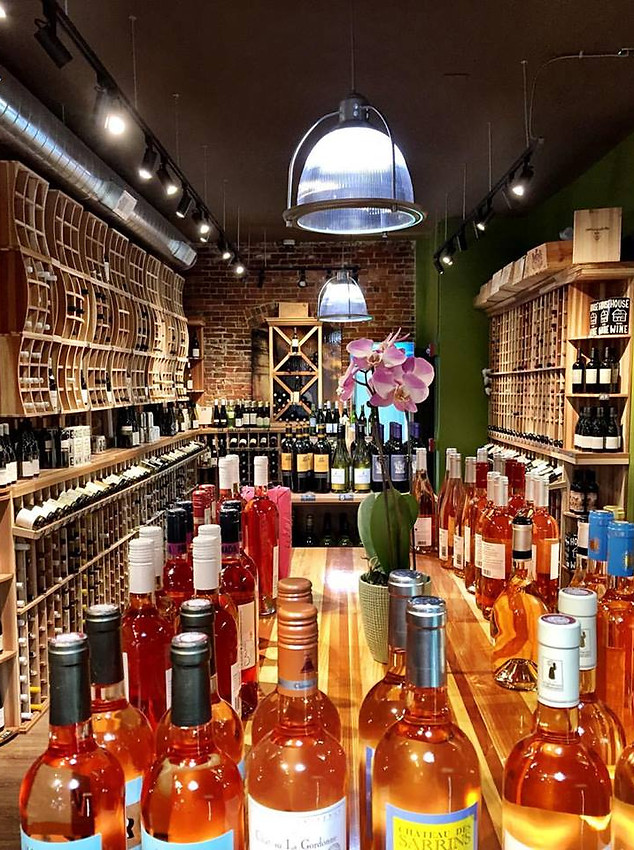
Identify the location of x shaped wooden shelves. This screenshot has height=850, width=634. (293, 397), (294, 347).